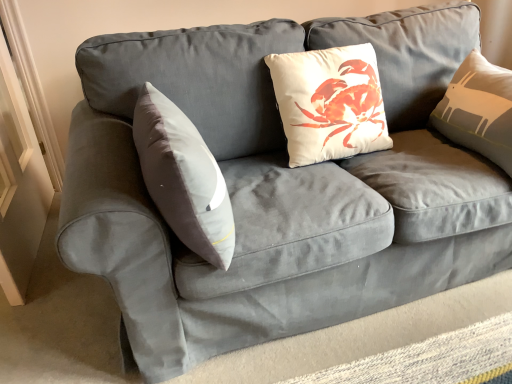
The image size is (512, 384). What do you see at coordinates (183, 177) in the screenshot? I see `gray fabric pillow at left` at bounding box center [183, 177].

Consider the image. What is the approximate width of gray fabric pillow at left?

25.17 centimeters.

In order to face gray fabric pillow at left, should I rotate leftwards or rightwards?

Rotate left and turn 9.524 degrees.

What is the approximate height of gray fabric pillow at left?

The height of gray fabric pillow at left is 47.23 centimeters.

This screenshot has height=384, width=512. Find the location of `gray fabric pillow at left`. gray fabric pillow at left is located at coordinates (183, 177).

At what (x,y) coordinates should I click in order to perform the action: click on gray fabric pillow at left. Please return your answer as a coordinate pair (x, y). Looking at the image, I should click on (183, 177).